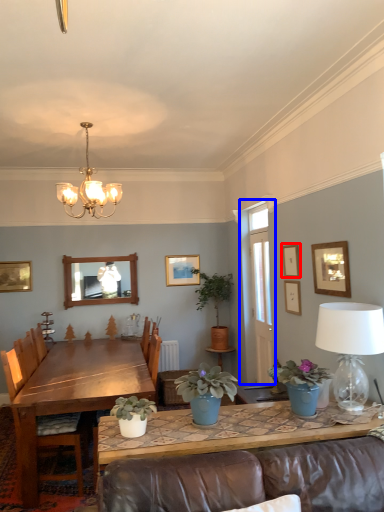
Question: Which point is further to the camera, picture frame (highlighted by a red box) or window (highlighted by a blue box)?

Choices:
 (A) picture frame
 (B) window

Answer: (B)